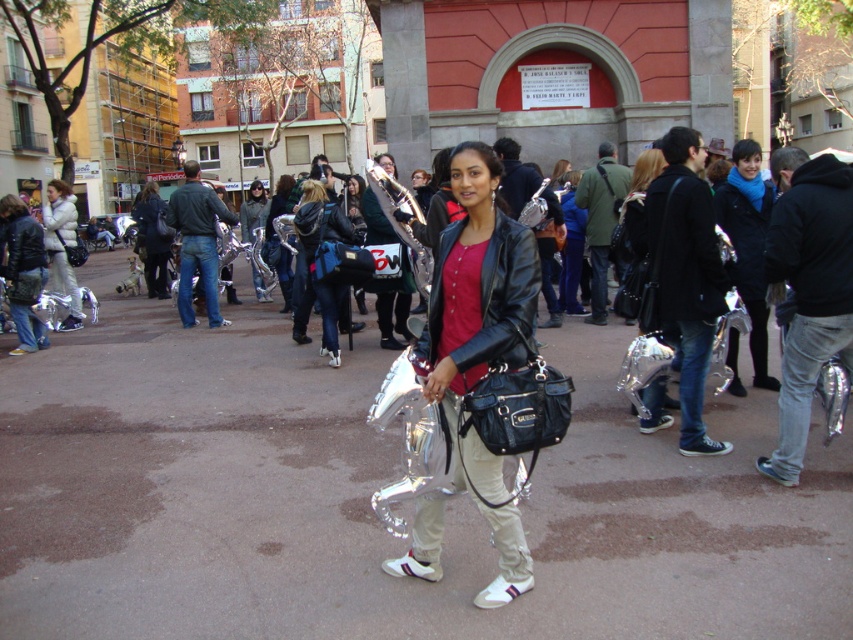
Question: Is white puffy jacket at left bigger than shiny silver balloon at center?

Choices:
 (A) no
 (B) yes

Answer: (B)

Question: Is denim jacket at center below white puffy jacket at left?

Choices:
 (A) yes
 (B) no

Answer: (A)

Question: Which of the following is the farthest from the observer?

Choices:
 (A) (328, 348)
 (B) (647, 157)
 (C) (57, 243)
 (D) (767, 474)

Answer: (C)

Question: Which of these objects is positioned farthest from the black leather jacket at right?

Choices:
 (A) shiny silver balloon at center
 (B) denim jacket at center
 (C) black leather jacket at center

Answer: (B)

Question: Is white puffy jacket at left wider than shiny silver balloon at center?

Choices:
 (A) no
 (B) yes

Answer: (B)

Question: Which object appears farthest from the camera in this image?

Choices:
 (A) matte black jacket at center
 (B) white puffy jacket at left
 (C) black leather jacket at right
 (D) shiny silver balloon at center

Answer: (B)